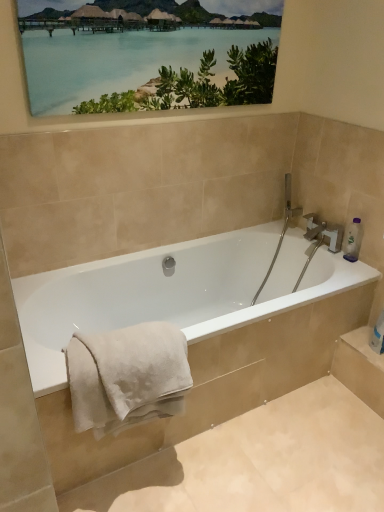
Question: Is matte wooden picture frame at upper center to the left of white soft towel at lower left from the viewer's perspective?

Choices:
 (A) yes
 (B) no

Answer: (B)

Question: From the image's perspective, does matte wooden picture frame at upper center appear higher than white soft towel at lower left?

Choices:
 (A) no
 (B) yes

Answer: (B)

Question: From the image's perspective, is matte wooden picture frame at upper center below white soft towel at lower left?

Choices:
 (A) yes
 (B) no

Answer: (B)

Question: Does matte wooden picture frame at upper center have a greater height compared to white soft towel at lower left?

Choices:
 (A) yes
 (B) no

Answer: (A)

Question: Considering the relative sizes of matte wooden picture frame at upper center and white soft towel at lower left in the image provided, is matte wooden picture frame at upper center thinner than white soft towel at lower left?

Choices:
 (A) no
 (B) yes

Answer: (B)

Question: Is matte wooden picture frame at upper center not inside white soft towel at lower left?

Choices:
 (A) yes
 (B) no

Answer: (A)

Question: Is clear plastic bottle at upper right thinner than white glossy bathtub at center?

Choices:
 (A) yes
 (B) no

Answer: (A)

Question: From the image's perspective, is clear plastic bottle at upper right on top of white glossy bathtub at center?

Choices:
 (A) yes
 (B) no

Answer: (A)

Question: From a real-world perspective, is clear plastic bottle at upper right on top of white glossy bathtub at center?

Choices:
 (A) yes
 (B) no

Answer: (A)

Question: Are clear plastic bottle at upper right and white glossy bathtub at center making contact?

Choices:
 (A) yes
 (B) no

Answer: (B)

Question: Can you confirm if clear plastic bottle at upper right is taller than white glossy bathtub at center?

Choices:
 (A) no
 (B) yes

Answer: (A)

Question: Does clear plastic bottle at upper right appear on the left side of white glossy bathtub at center?

Choices:
 (A) no
 (B) yes

Answer: (A)

Question: From a real-world perspective, is white glossy bathtub at center physically above white soft towel at lower left?

Choices:
 (A) no
 (B) yes

Answer: (A)